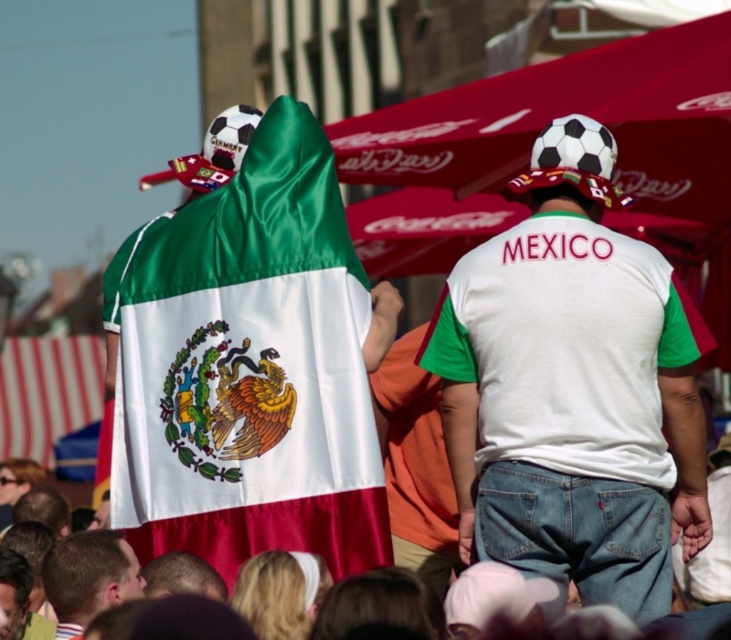
What do you see at coordinates (249, 365) in the screenshot?
I see `satin mexican flag at center` at bounding box center [249, 365].

Who is positioned more to the left, satin mexican flag at center or white cotton t-shirt at center?

Positioned to the left is satin mexican flag at center.

Between point (303, 182) and point (640, 513), which one is positioned in front?

Point (640, 513) is more forward.

The height and width of the screenshot is (640, 731). In order to click on satin mexican flag at center in this screenshot , I will do `click(249, 365)`.